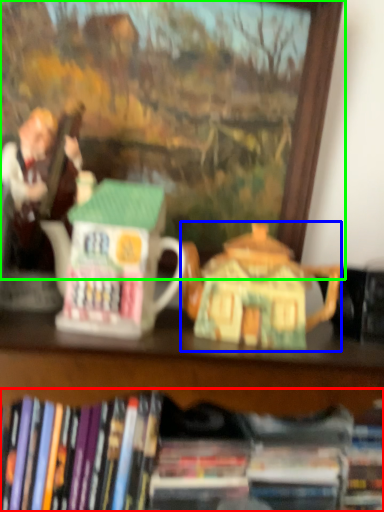
Question: Which object is positioned closest to book (highlighted by a red box)? Select from teapot (highlighted by a blue box) and picture frame (highlighted by a green box).

Choices:
 (A) teapot
 (B) picture frame

Answer: (A)